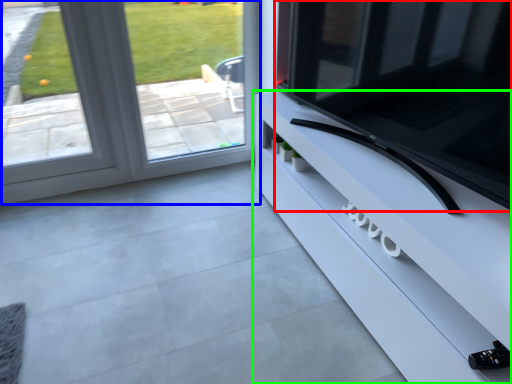
Question: Which object is the closest to the television (highlighted by a red box)? Choose among these: window (highlighted by a blue box) or furniture (highlighted by a green box).

Choices:
 (A) window
 (B) furniture

Answer: (B)